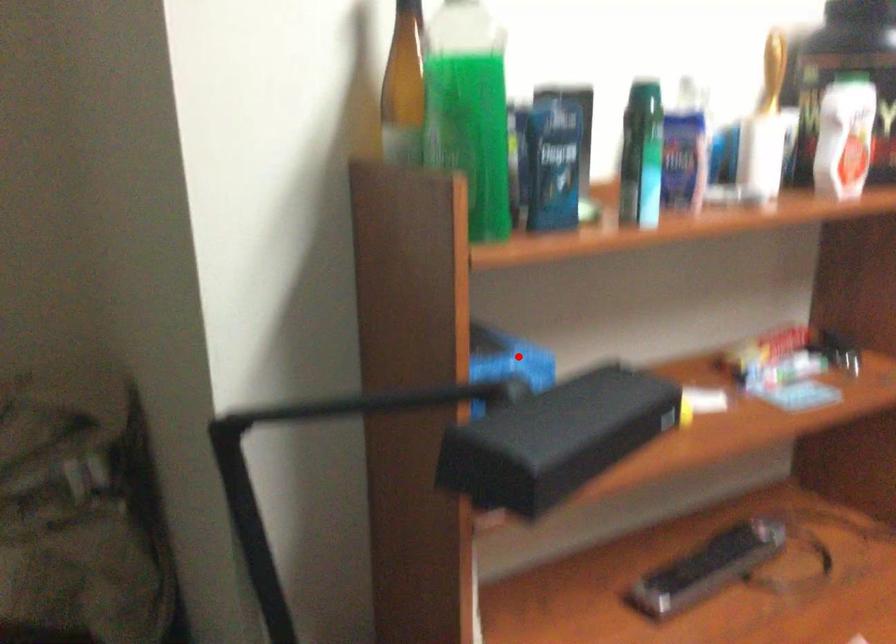
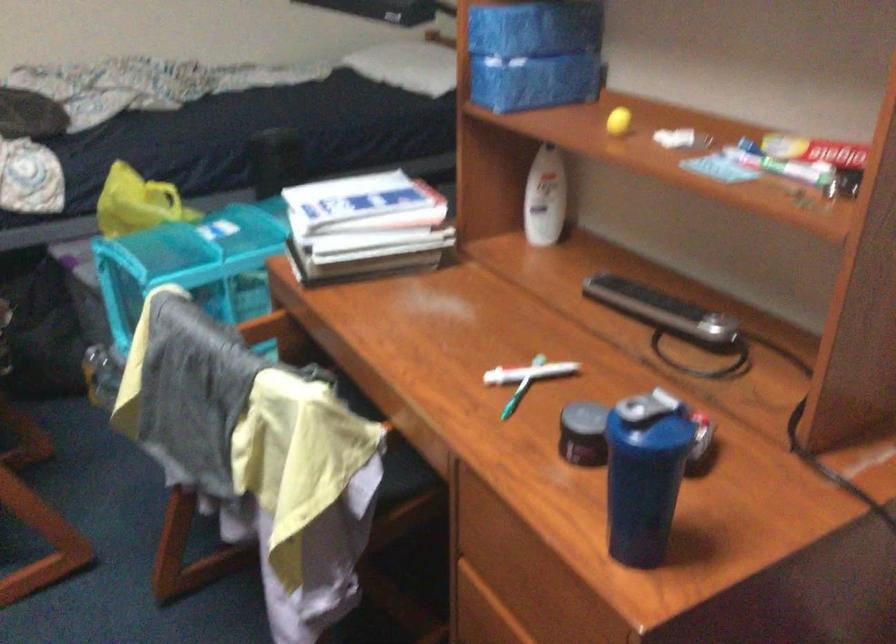
The point at the highlighted location is marked in the first image. Where is the corresponding point in the second image?

(536, 26)